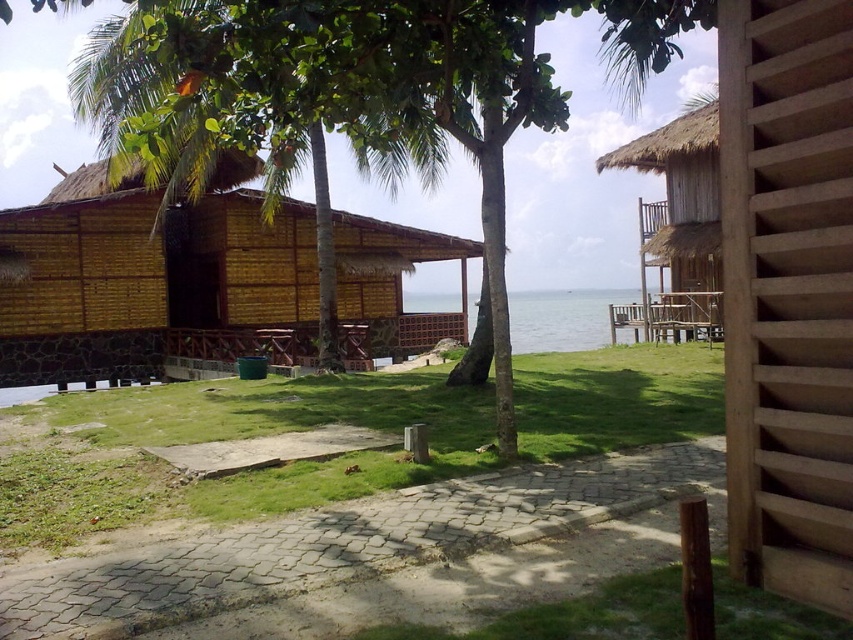
Between green grass at center and thatched bamboo hut at upper right, which one has less height?

green grass at center

Is point (32, 474) farther from camera compared to point (604, 157)?

No, (32, 474) is closer to viewer.

At what (x,y) coordinates should I click in order to perform the action: click on green grass at center. Please return your answer as a coordinate pair (x, y). This screenshot has height=640, width=853. Looking at the image, I should click on (236, 436).

Is matte bamboo hut at center to the left of green grass at center from the viewer's perspective?

Yes, matte bamboo hut at center is to the left of green grass at center.

Can you confirm if matte bamboo hut at center is taller than green grass at center?

Indeed, matte bamboo hut at center has a greater height compared to green grass at center.

In the scene shown: Who is more distant from viewer, (170, 324) or (144, 433)?

Positioned behind is point (170, 324).

Image resolution: width=853 pixels, height=640 pixels. In order to click on matte bamboo hut at center in this screenshot , I will do `click(154, 280)`.

Does thatched bamboo hut at upper right appear on the left side of clear blue water at center?

Incorrect, thatched bamboo hut at upper right is not on the left side of clear blue water at center.

Is point (705, 141) behind point (520, 310)?

No, it is not.

Between point (704, 106) and point (602, 300), which one is positioned behind?

The point (602, 300) is more distant.

The width and height of the screenshot is (853, 640). Find the location of `thatched bamboo hut at upper right`. thatched bamboo hut at upper right is located at coordinates (679, 221).